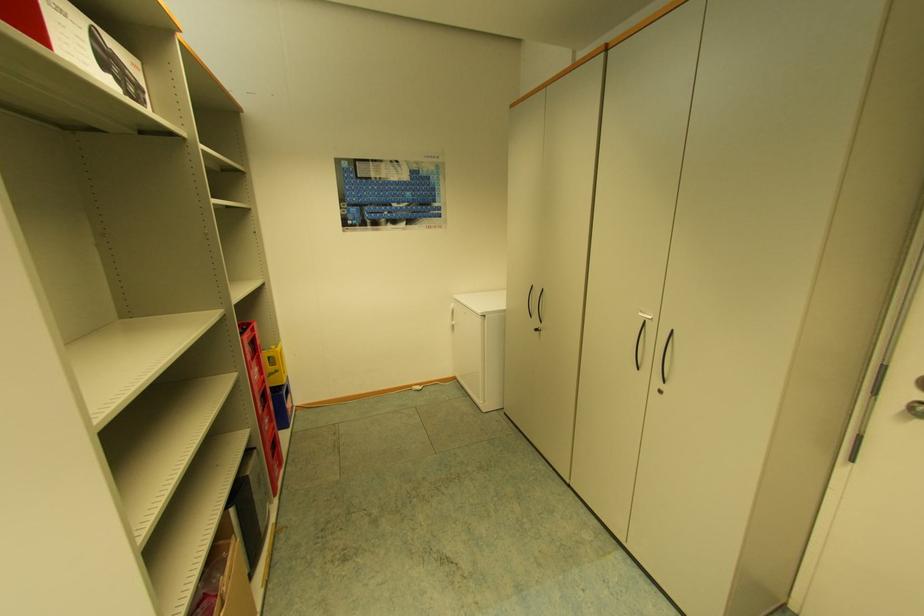
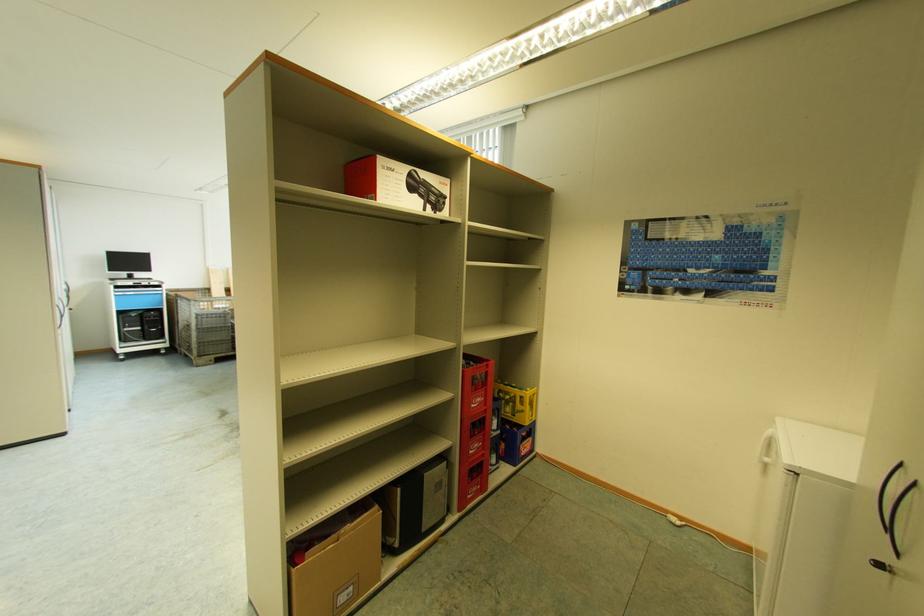
Question: The images are taken continuously from a first-person perspective. In which direction is your viewpoint rotating?

Choices:
 (A) Left
 (B) Right
 (C) Up
 (D) Down

Answer: (A)